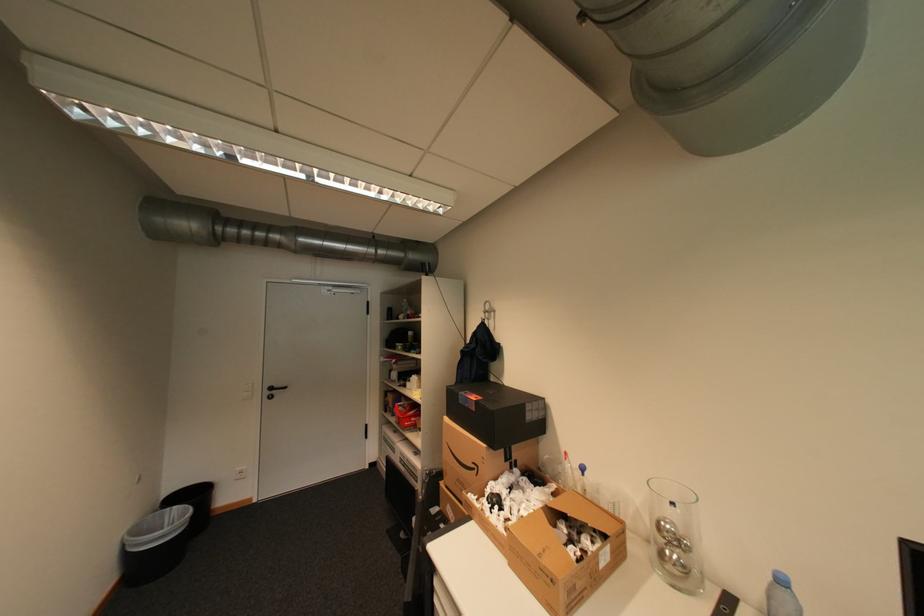
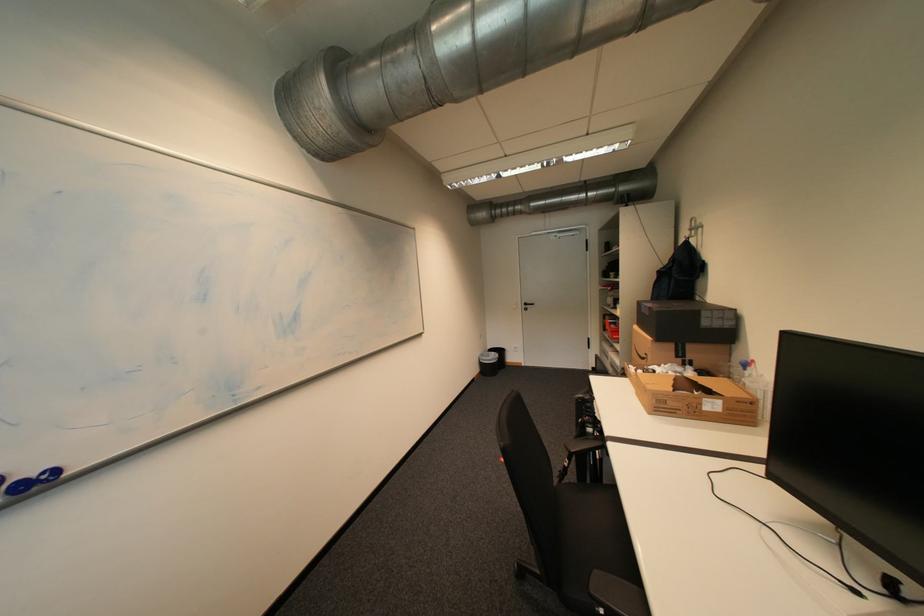
Question: The camera is either moving clockwise (left) or counter-clockwise (right) around the object. The first image is from the beginning of the video and the second image is from the end. Is the camera moving left or right when shooting the video?

Choices:
 (A) Left
 (B) Right

Answer: (B)